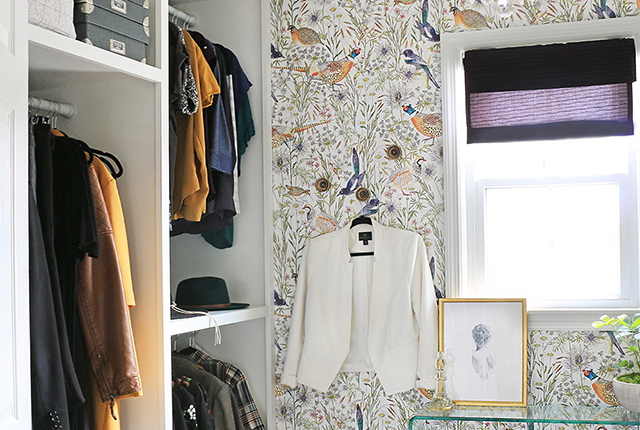
Image resolution: width=640 pixels, height=430 pixels. Identify the location of bird wallpaper. (326, 72).